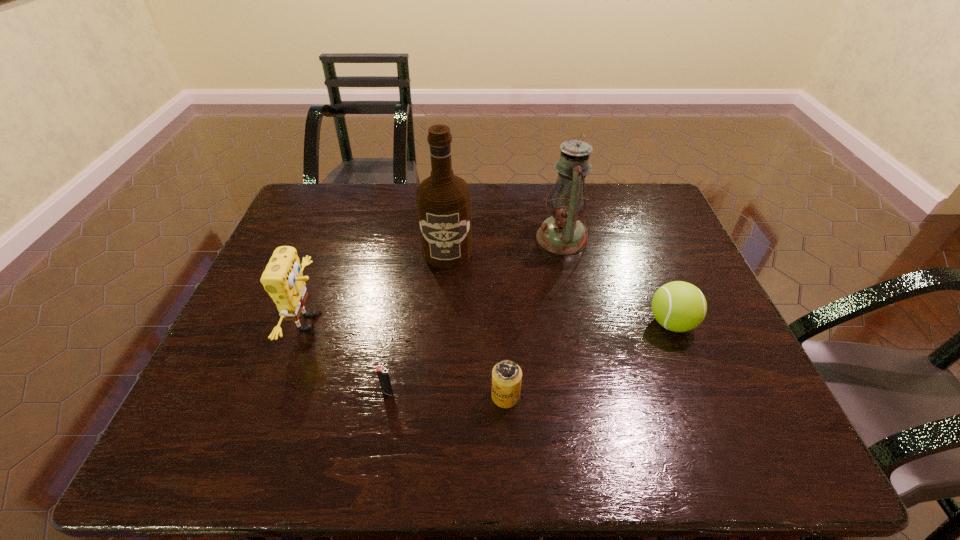
The image size is (960, 540). What are the coordinates of `vacant space at the right edge of the desktop` in the screenshot? It's located at coord(636,261).

Identify the location of free space at the far left corner of the desktop. The image size is (960, 540). (292, 219).

The image size is (960, 540). I want to click on free space at the far right corner of the desktop, so click(x=640, y=204).

Identify the location of free space between the beer can and the fifth object from right to left. (446, 394).

Locate an element on the screen. The height and width of the screenshot is (540, 960). vacant space that is in between the fourth object from right to left and the third object from right to left is located at coordinates [476, 324].

Where is `vacant area that lies between the oil lamp and the third tallest object`? The image size is (960, 540). vacant area that lies between the oil lamp and the third tallest object is located at coordinates (436, 280).

Identify the location of free space between the beer can and the igniter. Image resolution: width=960 pixels, height=540 pixels. (446, 394).

Image resolution: width=960 pixels, height=540 pixels. Find the location of `unoccupied position between the beer can and the igniter`. unoccupied position between the beer can and the igniter is located at coordinates (446, 394).

Image resolution: width=960 pixels, height=540 pixels. Identify the location of free space between the beer can and the tennis ball. (588, 360).

In order to click on free spot between the third object from right to left and the oil lamp in this screenshot , I will do `click(534, 317)`.